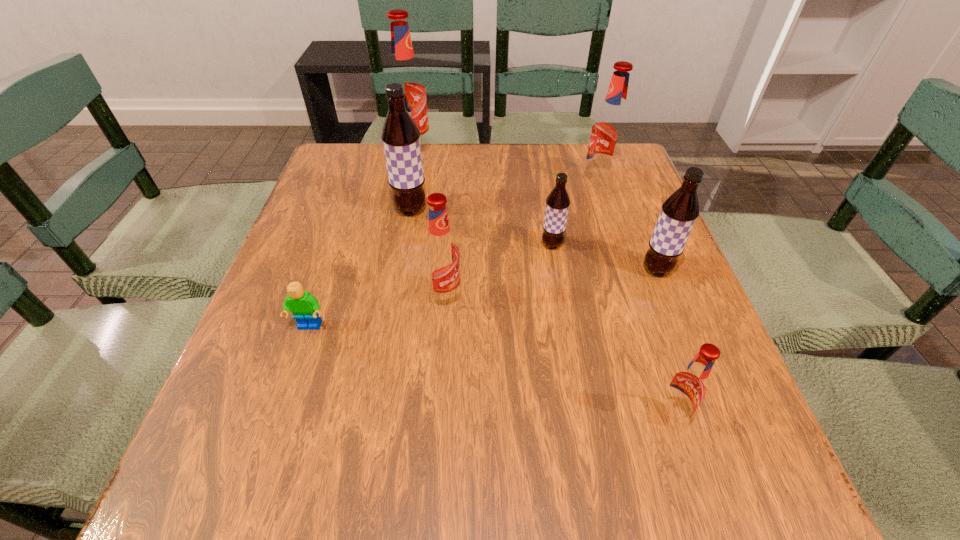
I want to click on free region located on the back of the second red root beer from left to right, so pos(453,188).

Locate an element on the screen. The width and height of the screenshot is (960, 540). vacant space located 0.200m on the left of the smallest red root beer is located at coordinates (529, 416).

At what (x,y) coordinates should I click in order to perform the action: click on free space located on the back of the fourth nearest root beer. Please return your answer as a coordinate pair (x, y). The height and width of the screenshot is (540, 960). Looking at the image, I should click on (539, 167).

Locate an element on the screen. The image size is (960, 540). free region located on the face of the shortest object is located at coordinates (265, 460).

Identify the location of object positioned at the left edge. Image resolution: width=960 pixels, height=540 pixels. (304, 306).

What are the coordinates of `object situated at the far right corner` in the screenshot? It's located at click(x=609, y=129).

The width and height of the screenshot is (960, 540). In the image, there is a desktop. In order to click on blank space at the far edge in this screenshot , I will do `click(481, 164)`.

In the image, there is a desktop. In order to click on vacant space at the near edge in this screenshot , I will do `click(332, 505)`.

You are a GUI agent. You are given a task and a screenshot of the screen. Output one action in this format:
    pyautogui.click(x=<x>, y=<y>)
    Task: Click on the vacant region at the left edge of the desktop
    
    Given the screenshot: What is the action you would take?
    pyautogui.click(x=322, y=230)

Locate an element on the screen. The height and width of the screenshot is (540, 960). vacant space at the right edge is located at coordinates (755, 438).